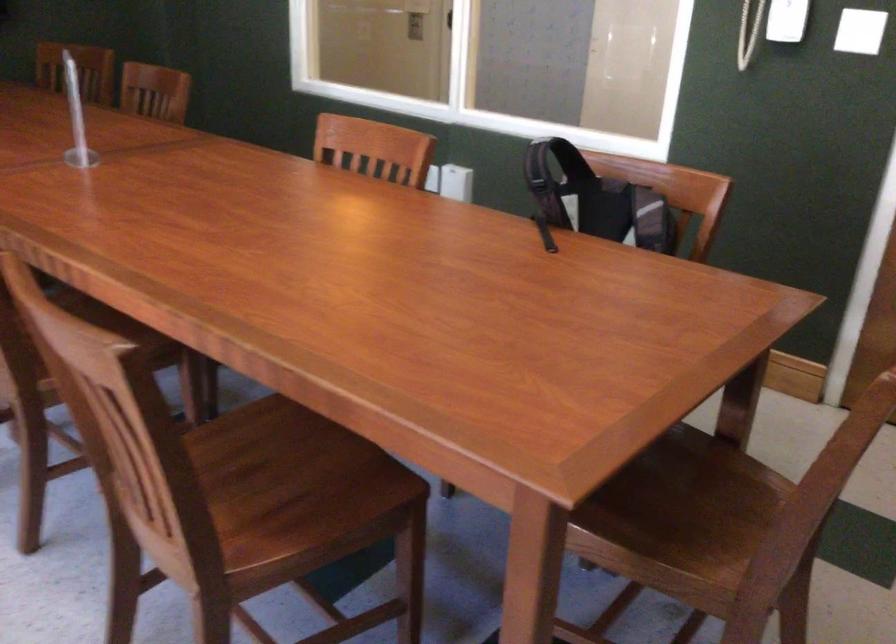
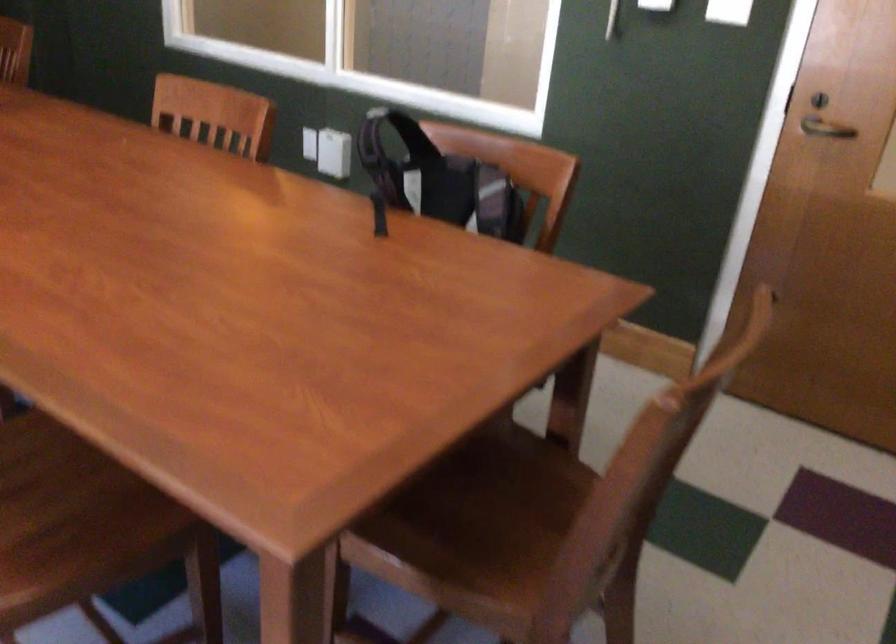
Locate, in the second image, the point that corresponds to [279,486] in the first image.

(52, 498)